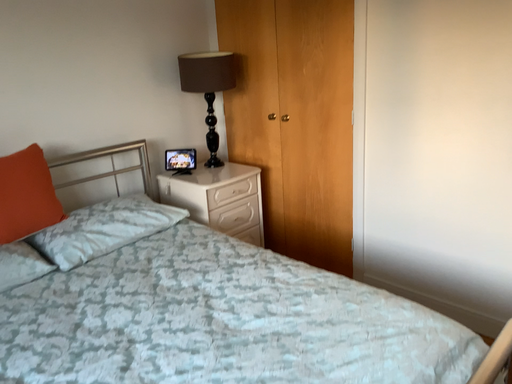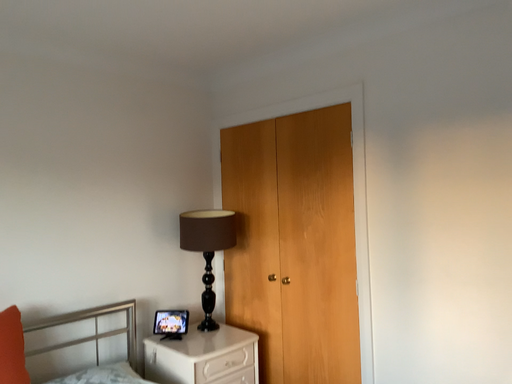
Question: How did the camera likely rotate when shooting the video?

Choices:
 (A) rotated upward
 (B) rotated downward

Answer: (A)